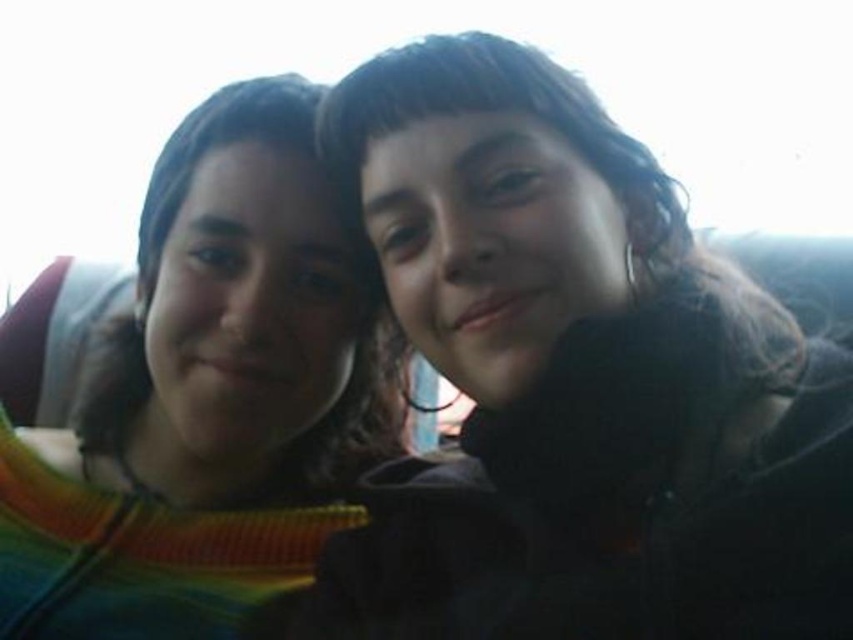
You are a photographer trying to adjust the lighting for a portrait. You notice the matte black jacket at center is at point (576, 381). Where should you place your reflector to bounce light onto the jacket?

The matte black jacket at center is located at point (576, 381), so you should place the reflector opposite to the current light source to bounce light onto the jacket.

You are a photographer trying to adjust the lighting for a portrait. You notice the matte black jacket at center and the rainbow striped sweater at left. Which object is positioned higher in the frame?

The matte black jacket at center is located above the rainbow striped sweater at left, so it is positioned higher in the frame.

You are a photographer trying to adjust the lighting for a photo shoot. You notice the matte black jacket at center and the rainbow striped sweater at left. Which object is positioned to the right of the other?

The matte black jacket at center is to the right of the rainbow striped sweater at left according to the description.